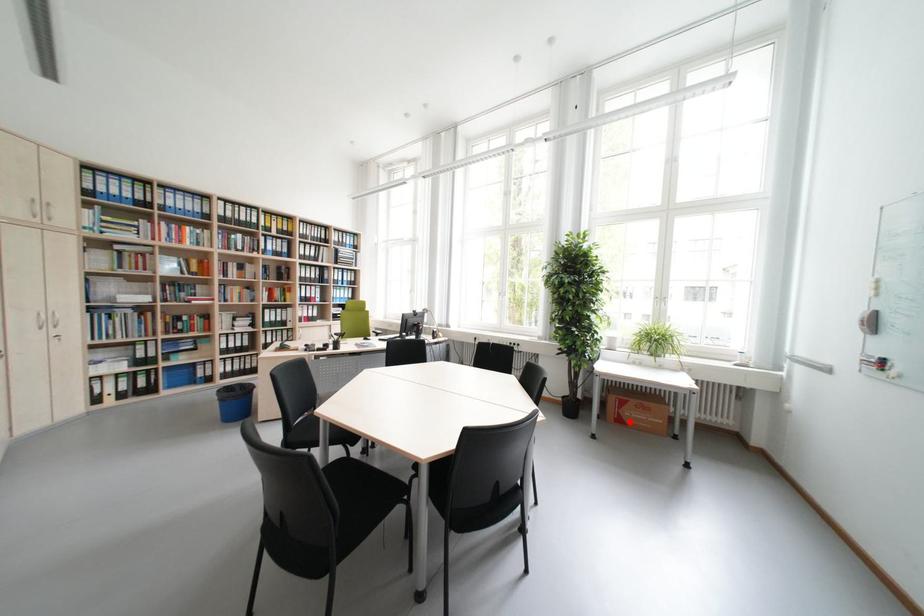
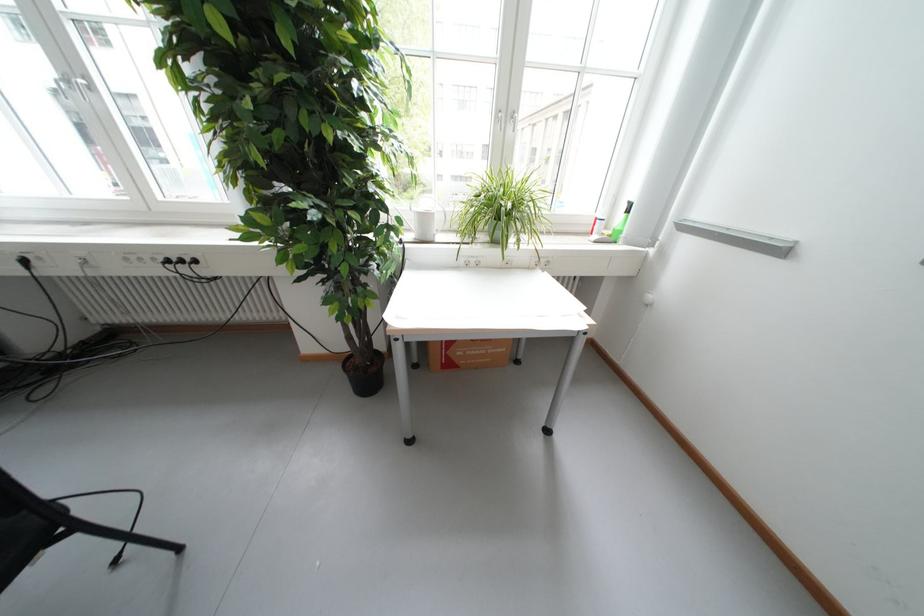
Question: A red point is marked in image1. In image2, is the corresponding 3D point closer to the camera or farther? Reply with the corresponding letter.

Choices:
 (A) The corresponding 3D point is closer.
 (B) The corresponding 3D point is farther.

Answer: (B)